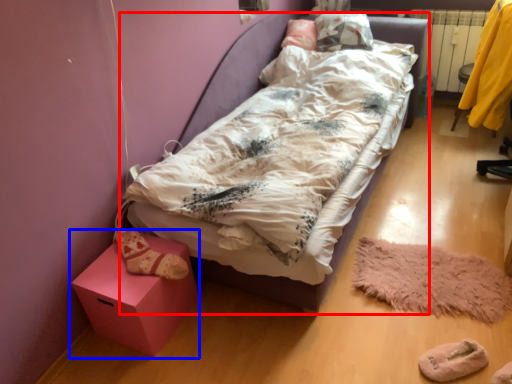
Question: Which object appears farthest to the camera in this image, bed (highlighted by a red box) or furniture (highlighted by a blue box)?

Choices:
 (A) bed
 (B) furniture

Answer: (B)